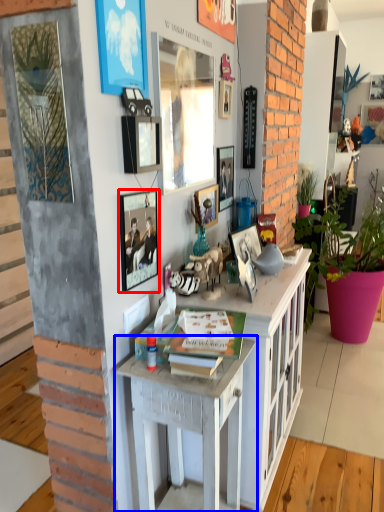
Question: Which point is closer to the camera, picture frame (highlighted by a red box) or desk (highlighted by a blue box)?

Choices:
 (A) picture frame
 (B) desk

Answer: (B)